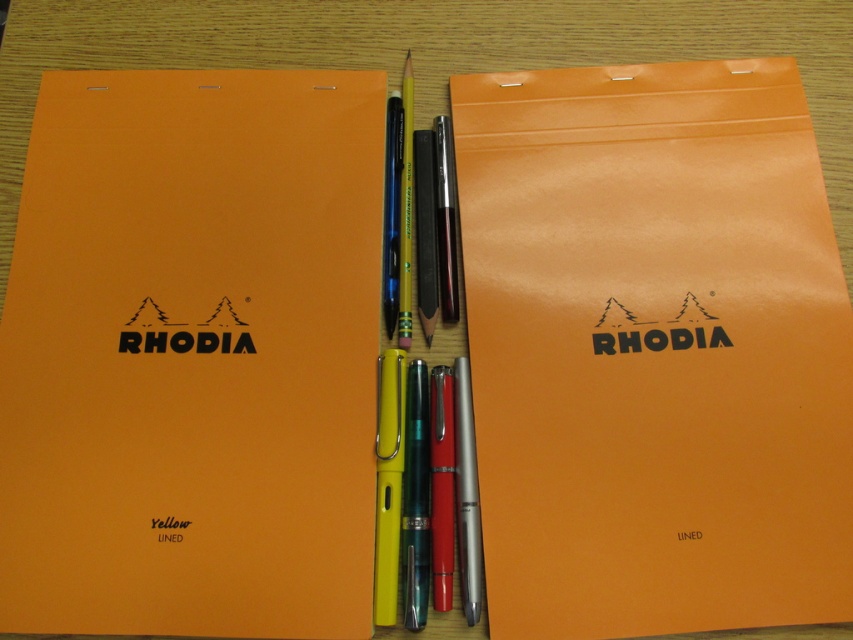
Question: Can you confirm if orange matte rhodia notebook at center is positioned below matte orange notebook at left?

Choices:
 (A) yes
 (B) no

Answer: (B)

Question: Considering the relative positions of orange matte rhodia notebook at center and matte orange notebook at left in the image provided, where is orange matte rhodia notebook at center located with respect to matte orange notebook at left?

Choices:
 (A) left
 (B) right

Answer: (B)

Question: Considering the relative positions of orange matte rhodia notebook at center and matte orange notebook at left in the image provided, where is orange matte rhodia notebook at center located with respect to matte orange notebook at left?

Choices:
 (A) right
 (B) left

Answer: (A)

Question: Which point is closer to the camera taking this photo?

Choices:
 (A) (654, 112)
 (B) (347, 83)

Answer: (A)

Question: Which object appears farthest from the camera in this image?

Choices:
 (A) orange matte rhodia notebook at center
 (B) matte orange notebook at left

Answer: (A)